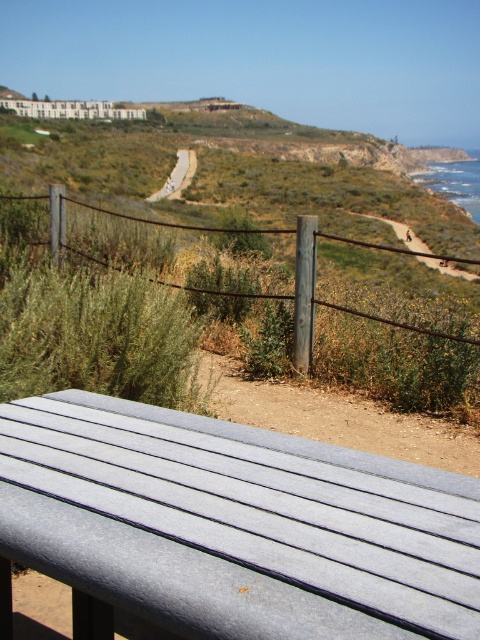
Question: Can you confirm if metal wire fence at lower center is wider than dirt/path at center?

Choices:
 (A) yes
 (B) no

Answer: (A)

Question: Does gray wood picnic table at lower center appear under metal wire fence at lower center?

Choices:
 (A) yes
 (B) no

Answer: (A)

Question: Which object appears farthest from the camera in this image?

Choices:
 (A) metal wire fence at lower center
 (B) dirt/path at center

Answer: (B)

Question: Which object is the farthest from the dirt/path at center?

Choices:
 (A) gray wood picnic table at lower center
 (B) metal wire fence at lower center

Answer: (A)

Question: Can you confirm if gray wood picnic table at lower center is bigger than metal wire fence at lower center?

Choices:
 (A) yes
 (B) no

Answer: (B)

Question: Considering the real-world distances, which object is closest to the metal wire fence at lower center?

Choices:
 (A) dirt/path at center
 (B) gray wood picnic table at lower center

Answer: (B)